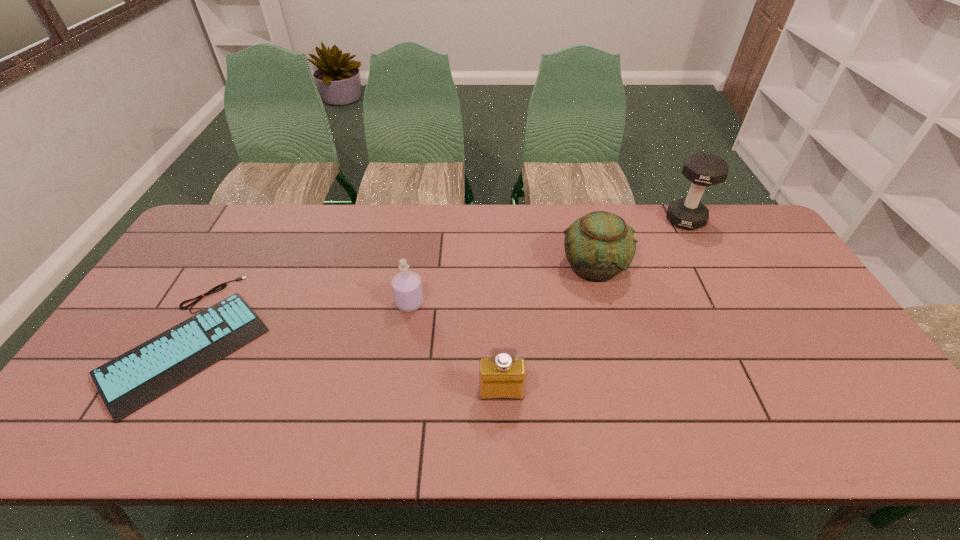
In order to click on vacant space at the near edge of the desktop in this screenshot , I will do `click(228, 422)`.

You are a GUI agent. You are given a task and a screenshot of the screen. Output one action in this format:
    pyautogui.click(x=<x>, y=<y>)
    Task: Click on the free region at the left edge
    
    Given the screenshot: What is the action you would take?
    pyautogui.click(x=160, y=321)

At what (x,y) coordinates should I click in order to perform the action: click on empty location between the shortest object and the dumbbell. Please return your answer as a coordinate pair (x, y). The image size is (960, 540). Looking at the image, I should click on (439, 280).

At what (x,y) coordinates should I click in order to perform the action: click on vacant area that lies between the computer keyboard and the farther perfume. Please return your answer as a coordinate pair (x, y). This screenshot has width=960, height=540. Looking at the image, I should click on (301, 321).

Where is `unoccupied position between the rightmost object and the fourth object from left to right`? unoccupied position between the rightmost object and the fourth object from left to right is located at coordinates (639, 243).

At what (x,y) coordinates should I click in order to perform the action: click on vacant region between the second object from right to left and the computer keyboard. Please return your answer as a coordinate pair (x, y). The width and height of the screenshot is (960, 540). Looking at the image, I should click on (394, 303).

Image resolution: width=960 pixels, height=540 pixels. I want to click on vacant space that's between the third object from right to left and the second object from left to right, so click(x=456, y=348).

The image size is (960, 540). Identify the location of vacant space that's between the computer keyboard and the pottery. (394, 303).

The height and width of the screenshot is (540, 960). I want to click on vacant area that lies between the second object from right to left and the shortest object, so click(x=394, y=303).

In order to click on vacant space that is in between the farther perfume and the rightmost object in this screenshot , I will do `click(547, 261)`.